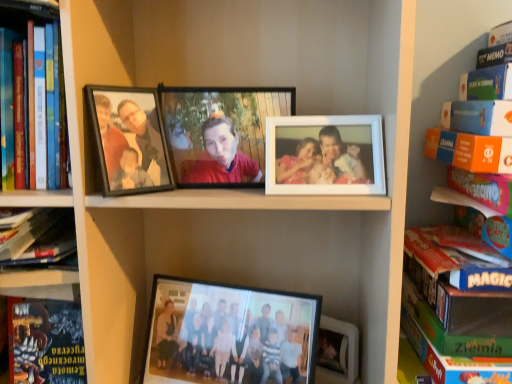
Question: Based on their sizes in the image, would you say hardcover book at left, arranged as the third book when viewed from the right, is bigger or smaller than hardcover book at left, marked as the 1th book in a left-to-right arrangement?

Choices:
 (A) big
 (B) small

Answer: (A)

Question: Is hardcover book at left, arranged as the third book when viewed from the right, inside the boundaries of hardcover book at left, the 4th book when ordered from right to left, or outside?

Choices:
 (A) inside
 (B) outside

Answer: (B)

Question: Considering the real-world distances, which object is closest to the green cardboard book at right, which is the fourth book from left to right?

Choices:
 (A) hardcover book at left, the 2th book from the left
 (B) hardcover book at lower left
 (C) hardcover book at left, marked as the 1th book in a left-to-right arrangement
 (D) black matte photo frame at upper left, marked as the 1th picture frame in a left-to-right arrangement
 (E) hardcover book at left, acting as the second book starting from the right

Answer: (D)

Question: Which object is positioned farthest from the hardcover book at left, the 2th book from the left?

Choices:
 (A) hardcover book at left, the 4th book when ordered from right to left
 (B) hardcover book at lower left
 (C) hardcover book at left, acting as the second book starting from the right
 (D) green cardboard book at right, which is the fourth book from left to right
 (E) matte black photo frame at center, arranged as the second picture frame when viewed from the left

Answer: (D)